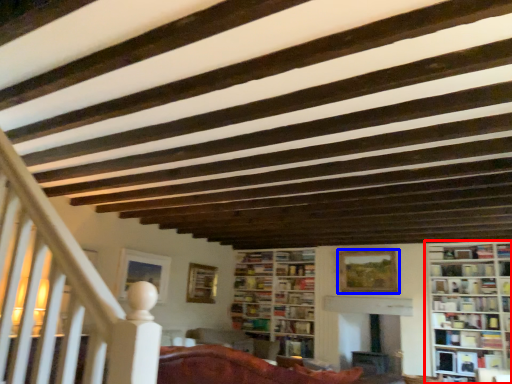
Question: Which object is further to the camera taking this photo, bookcase (highlighted by a red box) or picture frame (highlighted by a blue box)?

Choices:
 (A) bookcase
 (B) picture frame

Answer: (B)